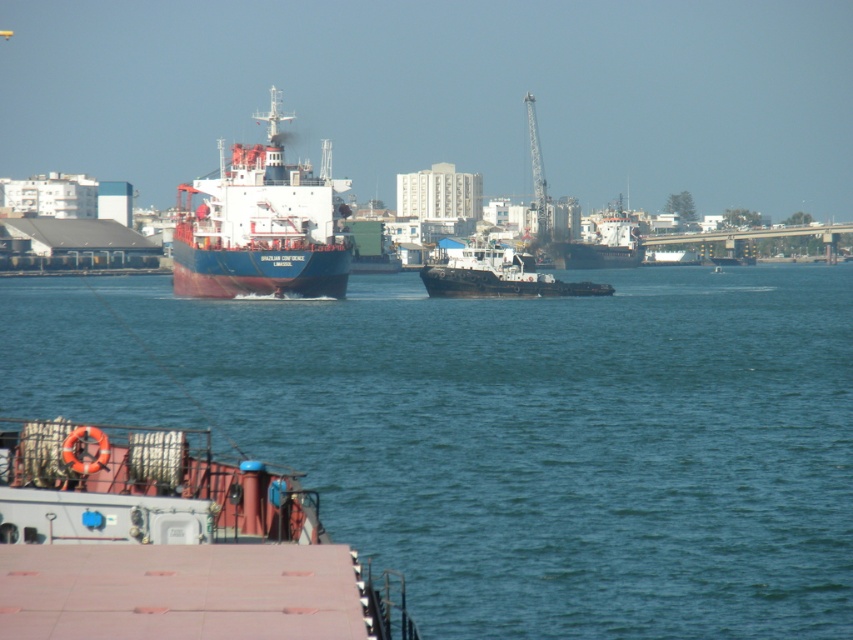
Question: Which of the following is the farthest from the observer?

Choices:
 (A) blue matte cargo ship at center
 (B) black matte tugboat at center
 (C) metallic gray crane at upper center

Answer: (C)

Question: Is rustic metal barge at lower left thinner than dark gray matte cargo ship at center?

Choices:
 (A) no
 (B) yes

Answer: (B)

Question: Does dark gray matte cargo ship at center appear on the right side of metallic gray crane at upper center?

Choices:
 (A) no
 (B) yes

Answer: (B)

Question: Which point is closer to the camera?

Choices:
 (A) (572, 241)
 (B) (276, 449)
 (C) (543, 177)
 (D) (502, 262)

Answer: (B)

Question: Which point appears closest to the camera in this image?

Choices:
 (A) (184, 211)
 (B) (819, 365)

Answer: (B)

Question: Does rustic metal barge at lower left appear on the left side of dark gray matte cargo ship at center?

Choices:
 (A) yes
 (B) no

Answer: (A)